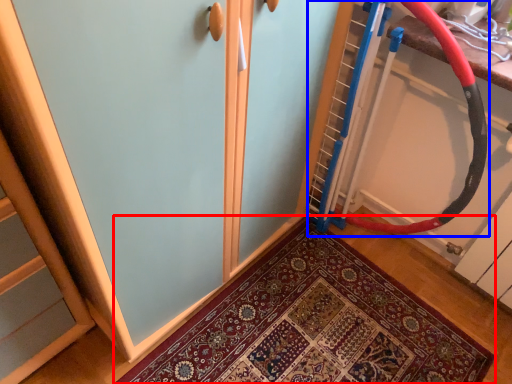
Question: Among these objects, which one is farthest to the camera, mat (highlighted by a red box) or garden hose (highlighted by a blue box)?

Choices:
 (A) mat
 (B) garden hose

Answer: (A)